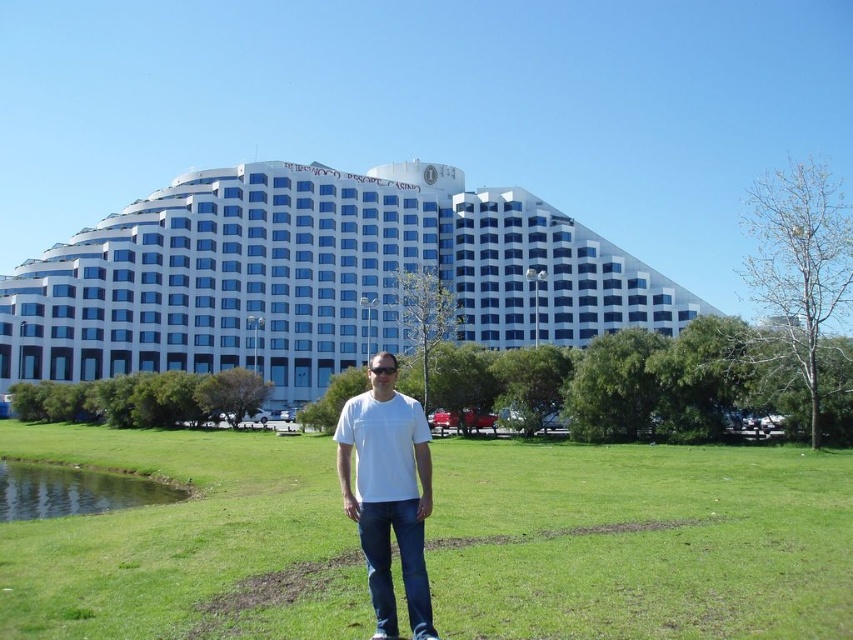
At what (x,y) coordinates should I click in order to perform the action: click on white glass building at center. Please return your answer as a coordinate pair (x, y). Looking at the image, I should click on (315, 276).

Is white glass building at center wider than white matte t-shirt at center?

Indeed, white glass building at center has a greater width compared to white matte t-shirt at center.

Between point (524, 276) and point (368, 403), which one is positioned in front?

Point (368, 403) is in front.

What are the coordinates of `white glass building at center` in the screenshot? It's located at (315, 276).

Does white glass building at center have a greater height compared to green grassy lake at lower left?

Indeed, white glass building at center has a greater height compared to green grassy lake at lower left.

Can you confirm if white glass building at center is positioned to the left of green grassy lake at lower left?

Incorrect, white glass building at center is not on the left side of green grassy lake at lower left.

Who is more forward, (338,234) or (25,518)?

Positioned in front is point (25,518).

You are a GUI agent. You are given a task and a screenshot of the screen. Output one action in this format:
    pyautogui.click(x=<x>, y=<y>)
    Task: Click on the white glass building at center
    The width and height of the screenshot is (853, 640).
    Given the screenshot: What is the action you would take?
    pyautogui.click(x=315, y=276)

Can you confirm if white matte t-shirt at center is bigger than green grassy lake at lower left?

Yes.

Who is higher up, white matte t-shirt at center or green grassy lake at lower left?

white matte t-shirt at center is above.

Between point (415, 484) and point (53, 493), which one is positioned in front?

Point (415, 484)

Image resolution: width=853 pixels, height=640 pixels. What are the coordinates of `white matte t-shirt at center` in the screenshot? It's located at (387, 492).